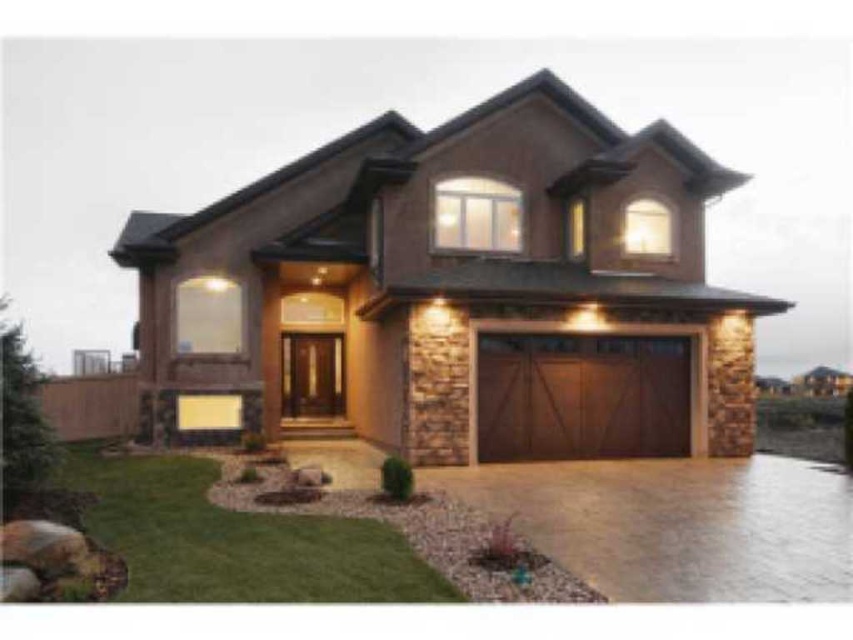
You are standing in front of the house and notice two points marked on its facade. The first point is at coordinates point (392, 301) and the second is at point (601, 403). Which of these points is closer to you?

Point (392, 301) is in front of point (601, 403), so it is closer to you.